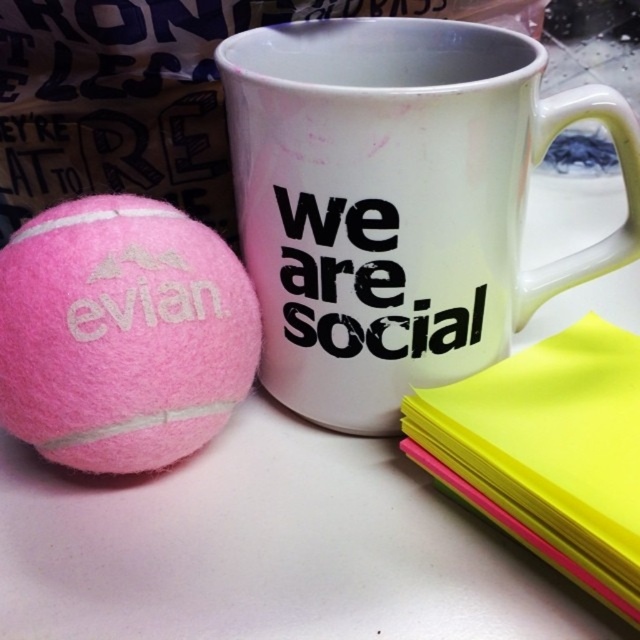
Can you confirm if white glossy mug at center is positioned to the right of yellow paper at right?

Incorrect, white glossy mug at center is not on the right side of yellow paper at right.

Who is more forward, (410, 38) or (577, 406)?

Point (577, 406) is more forward.

Locate an element on the screen. Image resolution: width=640 pixels, height=640 pixels. white glossy mug at center is located at coordinates (397, 202).